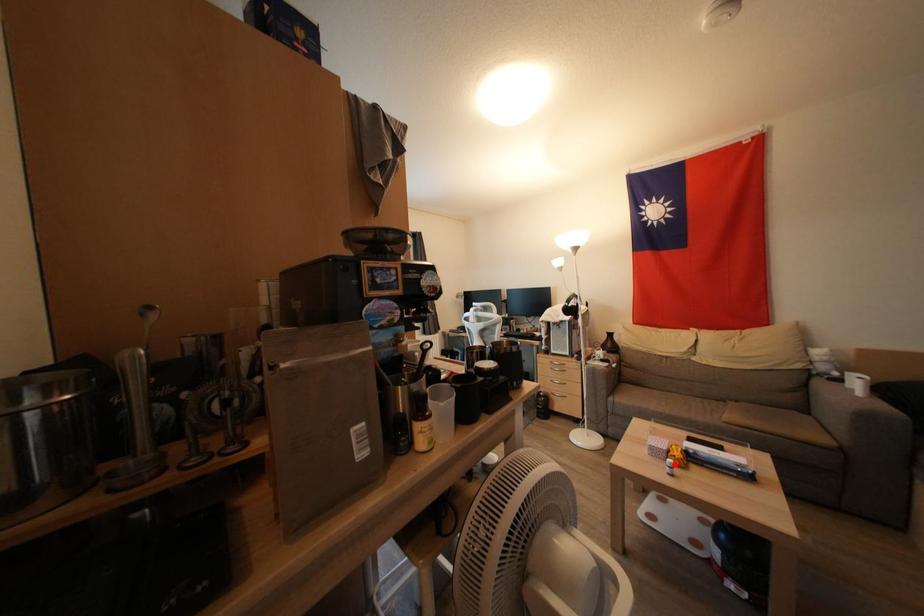
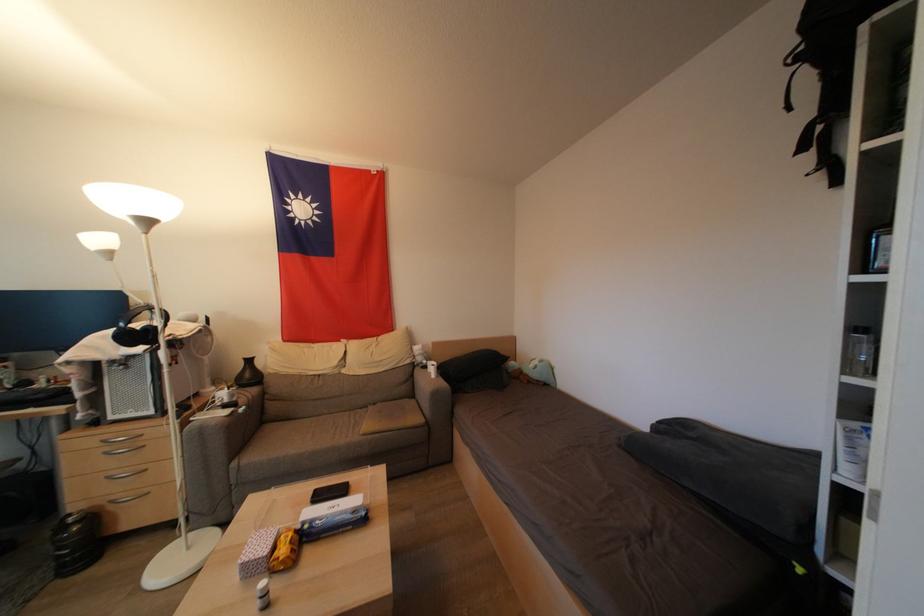
Locate, in the second image, the point that corresponds to the highlighted location in the first image.

(268, 586)